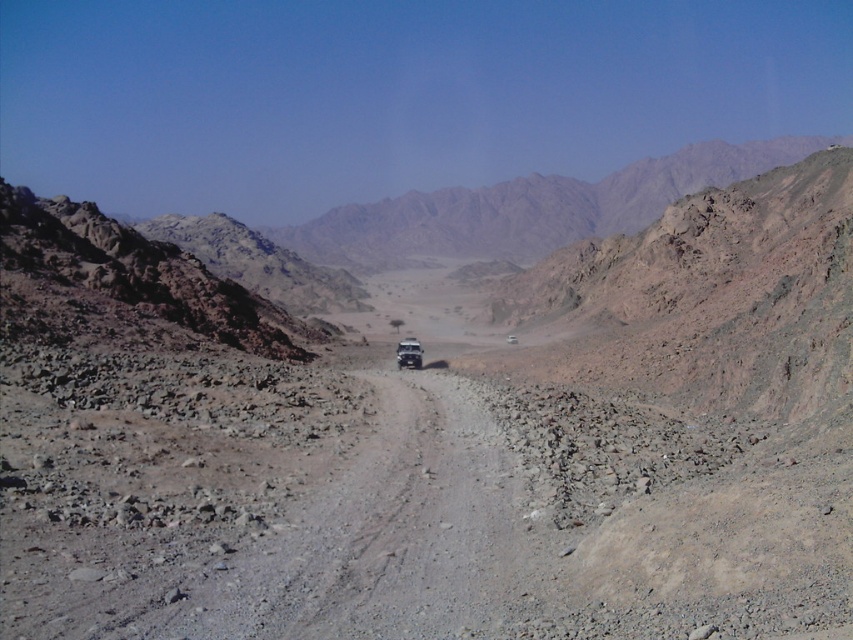
Is rugged brown mountain at center below metallic silver suv at center?

Incorrect, rugged brown mountain at center is not positioned below metallic silver suv at center.

Does rugged brown mountain at center have a greater height compared to metallic silver suv at center?

Indeed, rugged brown mountain at center has a greater height compared to metallic silver suv at center.

Is point (364, 241) positioned before point (399, 353)?

No, it is not.

The height and width of the screenshot is (640, 853). What are the coordinates of `rugged brown mountain at center` in the screenshot? It's located at (531, 209).